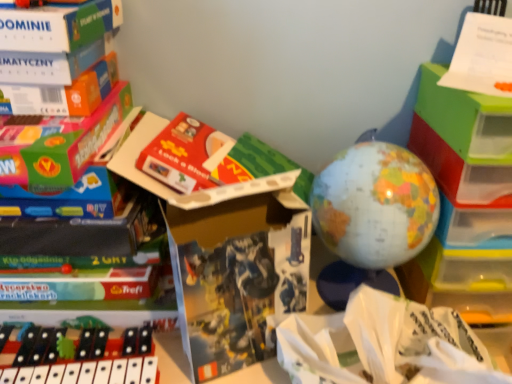
Question: Can you confirm if white paper at center is shorter than matte plastic globe at center, positioned as the 1th toy in right-to-left order?

Choices:
 (A) no
 (B) yes

Answer: (B)

Question: Is white paper at center to the left of matte plastic globe at center, positioned as the 1th toy in right-to-left order, from the viewer's perspective?

Choices:
 (A) no
 (B) yes

Answer: (A)

Question: Are white paper at center and matte plastic globe at center, positioned as the second toy in left-to-right order, making contact?

Choices:
 (A) no
 (B) yes

Answer: (A)

Question: Considering the relative positions of white paper at center and matte plastic globe at center, positioned as the second toy in left-to-right order, in the image provided, is white paper at center to the right of matte plastic globe at center, positioned as the second toy in left-to-right order, from the viewer's perspective?

Choices:
 (A) yes
 (B) no

Answer: (A)

Question: From the image's perspective, is white paper at center located above matte plastic globe at center, which is counted as the second toy, starting from the bottom?

Choices:
 (A) no
 (B) yes

Answer: (A)

Question: Is there a large distance between white paper at center and matte plastic globe at center, positioned as the 1th toy in right-to-left order?

Choices:
 (A) no
 (B) yes

Answer: (A)

Question: Is black plastic xylophone at lower left, which appears as the second toy when viewed from the top, wider than matte plastic globe at center, the 1th toy from the top?

Choices:
 (A) yes
 (B) no

Answer: (A)

Question: Is black plastic xylophone at lower left, placed as the second toy when sorted from right to left, to the left of matte plastic globe at center, positioned as the 1th toy in right-to-left order, from the viewer's perspective?

Choices:
 (A) yes
 (B) no

Answer: (A)

Question: Is matte plastic globe at center, positioned as the 1th toy in right-to-left order, inside black plastic xylophone at lower left, the first toy when ordered from bottom to top?

Choices:
 (A) yes
 (B) no

Answer: (B)

Question: Is black plastic xylophone at lower left, placed as the second toy when sorted from right to left, thinner than matte plastic globe at center, positioned as the 1th toy in right-to-left order?

Choices:
 (A) no
 (B) yes

Answer: (A)

Question: Is black plastic xylophone at lower left, which appears as the second toy when viewed from the top, at the right side of matte plastic globe at center, which is counted as the second toy, starting from the bottom?

Choices:
 (A) no
 (B) yes

Answer: (A)

Question: Is the position of black plastic xylophone at lower left, the first toy when ordered from bottom to top, less distant than that of matte plastic globe at center, the 1th toy from the top?

Choices:
 (A) no
 (B) yes

Answer: (B)

Question: From a real-world perspective, is black plastic xylophone at lower left, which appears as the 1th toy when viewed from the left, located beneath matte cardboard book at center?

Choices:
 (A) no
 (B) yes

Answer: (B)